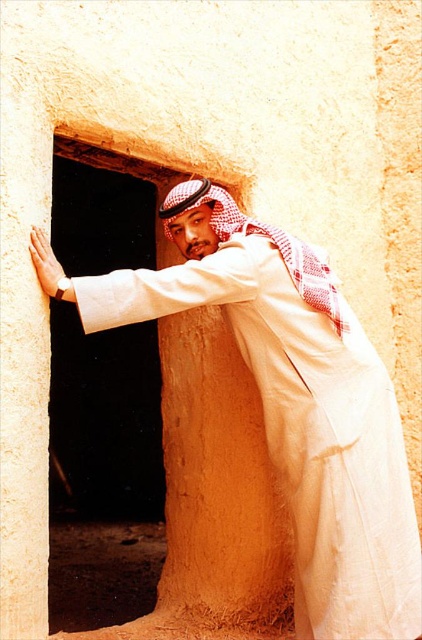
Question: Does white cotton robe at center come behind matte beige stone wall at center?

Choices:
 (A) no
 (B) yes

Answer: (A)

Question: Which object is closer to the camera taking this photo?

Choices:
 (A) white cotton robe at center
 (B) matte beige stone wall at center

Answer: (A)

Question: Can you confirm if white cotton robe at center is positioned above matte beige stone wall at center?

Choices:
 (A) yes
 (B) no

Answer: (A)

Question: Is white cotton robe at center bigger than matte beige stone wall at center?

Choices:
 (A) no
 (B) yes

Answer: (B)